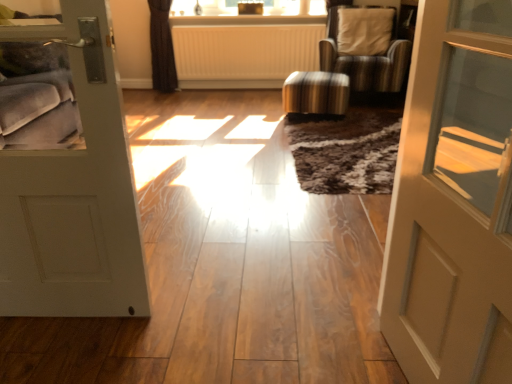
Find the location of a particular element. unoccupied area in front of striped fabric stool at center is located at coordinates (326, 131).